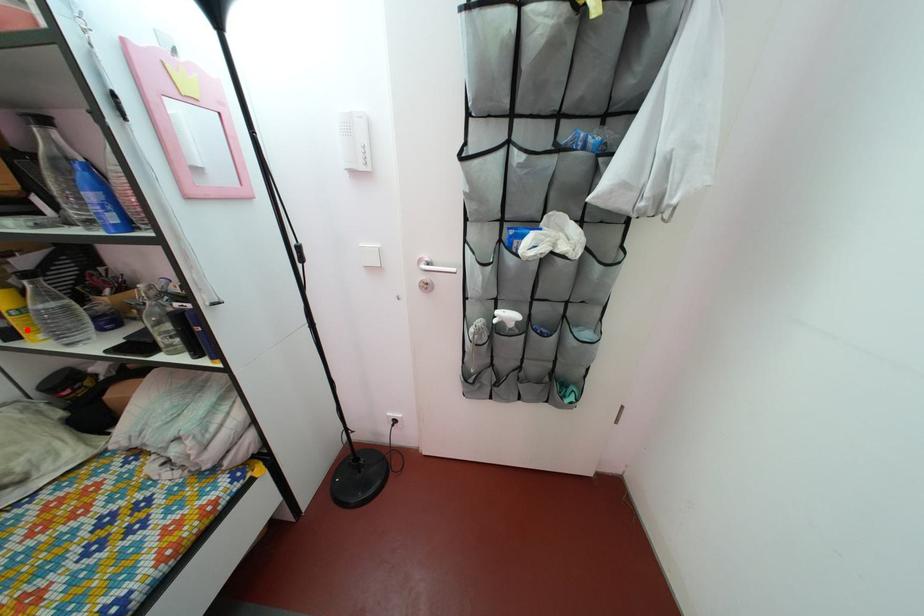
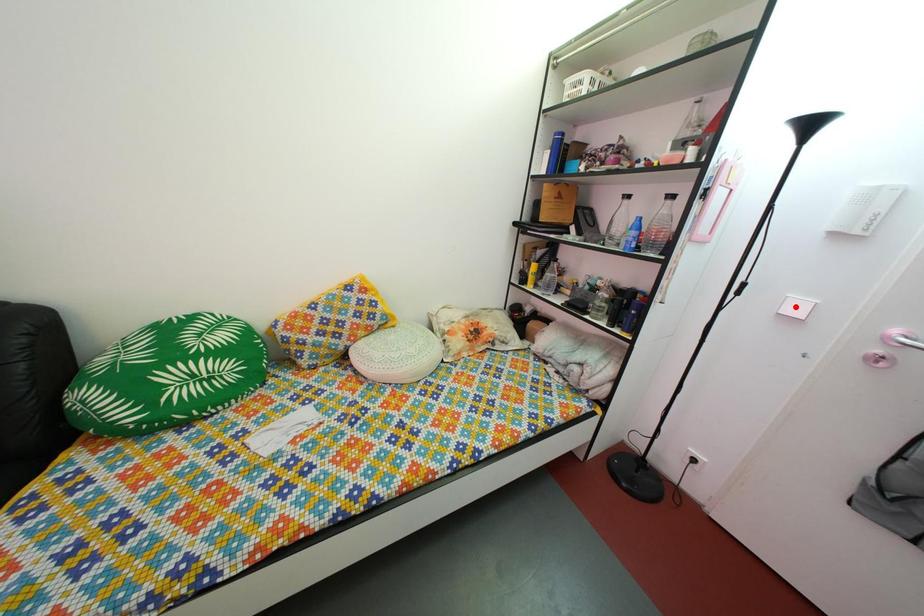
I am providing you with two images of the same scene from different viewpoints. A red point is marked on the first image and another point is marked on the second image. Is the marked point in image1 the same physical position as the marked point in image2?

No